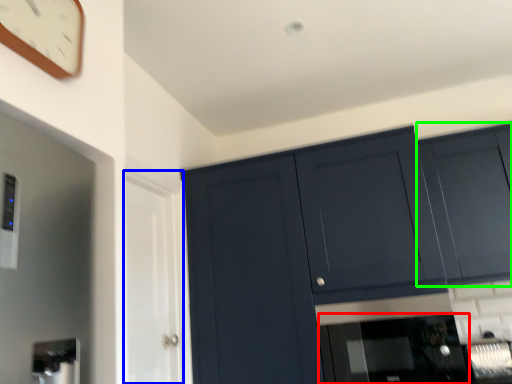
Question: Which object is positioned closest to appliance (highlighted by a red box)? Select from glass door (highlighted by a blue box) and cabinetry (highlighted by a green box).

Choices:
 (A) glass door
 (B) cabinetry

Answer: (B)